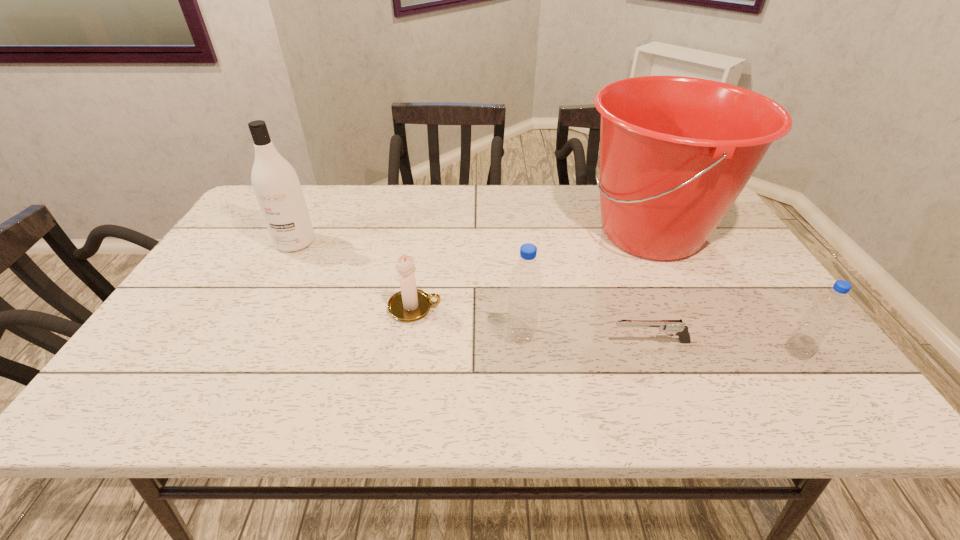
At what (x,y) coordinates should I click in order to perform the action: click on free point that keeps the water bottles evenly spaced on the left. Please return your answer as a coordinate pair (x, y). This screenshot has height=540, width=960. Looking at the image, I should click on (265, 320).